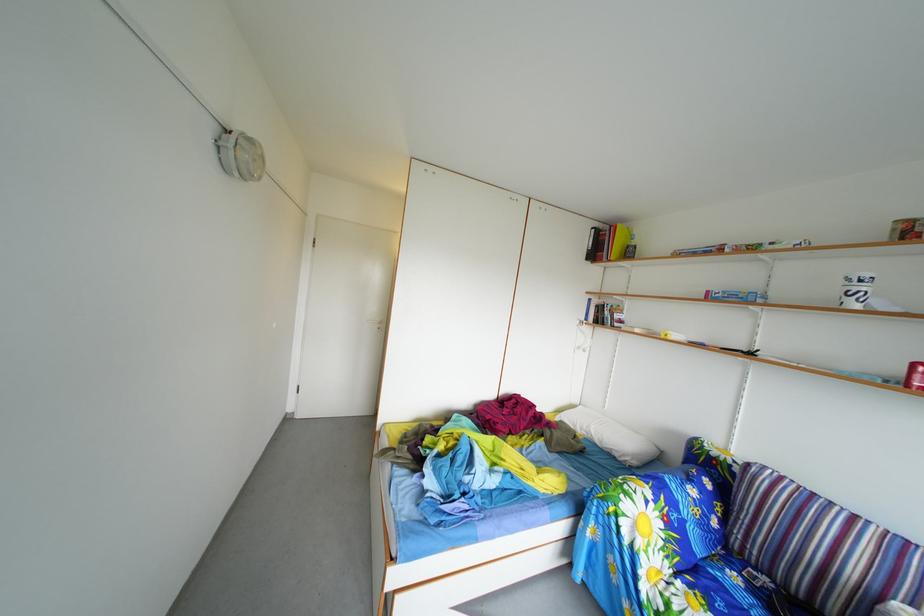
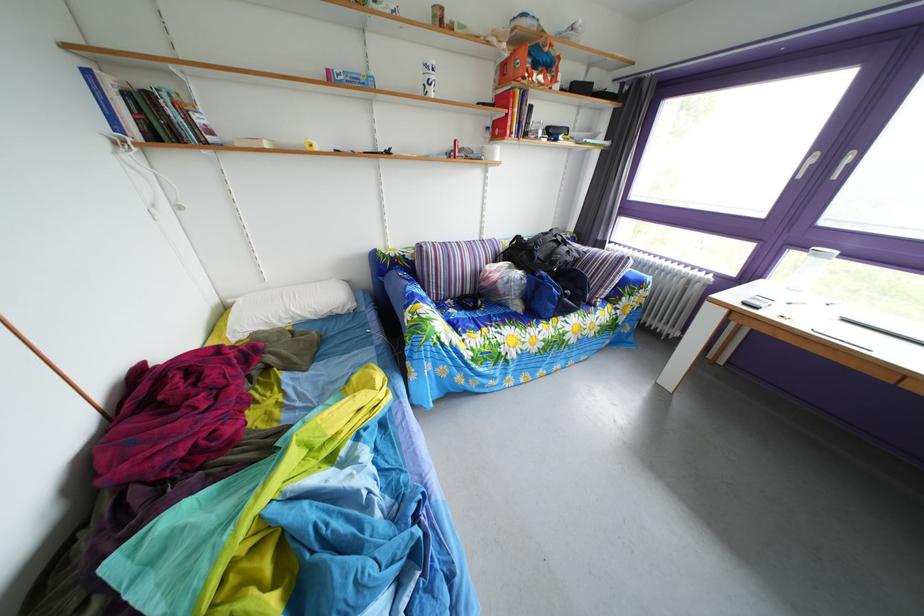
Find the pixel in the second image that matches (x=719, y=301) in the first image.

(339, 79)